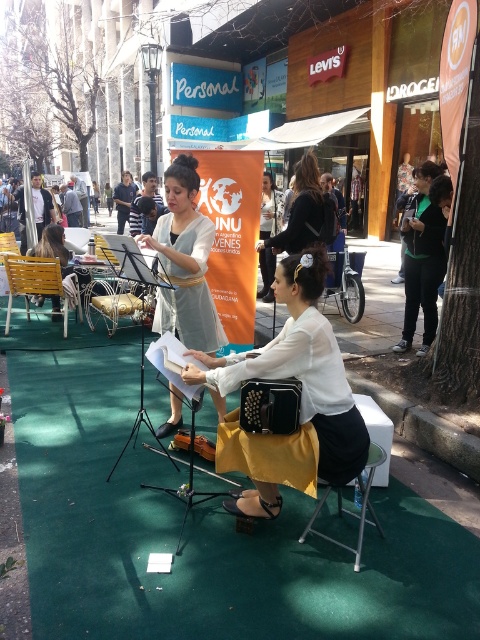
Can you confirm if matte gray dress at center is smaller than metallic silver folding chair at center?

No.

Who is taller, matte gray dress at center or metallic silver folding chair at center?

Standing taller between the two is matte gray dress at center.

The height and width of the screenshot is (640, 480). What do you see at coordinates (184, 262) in the screenshot?
I see `matte gray dress at center` at bounding box center [184, 262].

Identify the location of matte gray dress at center. (184, 262).

Between point (164, 428) and point (56, 243), which one is positioned behind?

The point (56, 243) is behind.

Who is taller, matte gray dress at center or matte yellow skirt at lower left?

matte gray dress at center

This screenshot has height=640, width=480. Describe the element at coordinates (184, 262) in the screenshot. I see `matte gray dress at center` at that location.

Where is `matte gray dress at center`? The width and height of the screenshot is (480, 640). matte gray dress at center is located at coordinates point(184,262).

Is white matte accordion at center below yellow plastic chair at left?

Yes.

Which is behind, point (283, 355) or point (19, 289)?

The point (19, 289) is more distant.

At what (x,y) coordinates should I click in order to perform the action: click on white matte accordion at center. Please return your answer as a coordinate pair (x, y). Image resolution: width=480 pixels, height=640 pixels. Looking at the image, I should click on [301, 369].